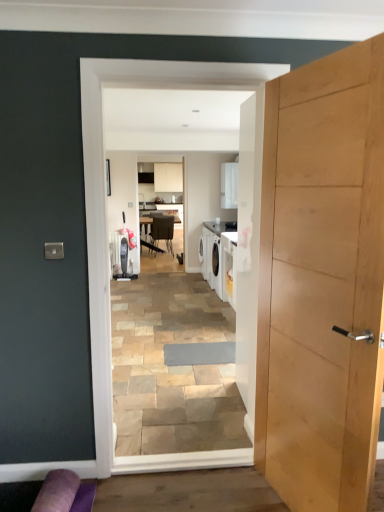
The width and height of the screenshot is (384, 512). What do you see at coordinates (64, 493) in the screenshot? I see `purple fabric couch at lower left` at bounding box center [64, 493].

What do you see at coordinates (321, 280) in the screenshot? I see `light wood door at right` at bounding box center [321, 280].

The width and height of the screenshot is (384, 512). In order to click on white glossy laundry machine at center in this screenshot , I will do `click(177, 407)`.

Locate an element on the screen. couch on the right of metallic silver chair at center is located at coordinates (64, 493).

Considering the sizes of purple fabric couch at lower left and metallic silver chair at center in the image, is purple fabric couch at lower left bigger or smaller than metallic silver chair at center?

Considering their sizes, purple fabric couch at lower left takes up less space than metallic silver chair at center.

Does point (36, 506) come in front of point (158, 222)?

That is True.

Consider the image. How many degrees apart are the facing directions of purple fabric couch at lower left and metallic silver chair at center?

The angle between the facing direction of purple fabric couch at lower left and the facing direction of metallic silver chair at center is 173 degrees.

From a real-world perspective, between purple fabric couch at lower left and white glossy laundry machine at center, who is vertically higher?

white glossy laundry machine at center is physically above.

Is point (78, 508) positioned after point (146, 263)?

No.

In the scene shown: How different are the orientations of purple fabric couch at lower left and white glossy laundry machine at center in degrees?

There is a 2.59-degree angle between the facing directions of purple fabric couch at lower left and white glossy laundry machine at center.

Can you confirm if purple fabric couch at lower left is bigger than white glossy laundry machine at center?

No.

Is white glossy laundry machine at center far from metallic silver chair at center?

Yes.

Based on the photo, which is closer to the camera, (244, 455) or (153, 216)?

Point (244, 455).

In the scene shown: Which of these two, white glossy laundry machine at center or metallic silver chair at center, is smaller?

Smaller between the two is white glossy laundry machine at center.

From the image's perspective, would you say light wood door at right is shown under white glossy laundry machine at center?

Yes, from the image's perspective, light wood door at right is below white glossy laundry machine at center.

Considering the relative positions of light wood door at right and white glossy laundry machine at center in the image provided, is light wood door at right to the left of white glossy laundry machine at center from the viewer's perspective?

No, light wood door at right is not to the left of white glossy laundry machine at center.

Considering the positions of points (270, 447) and (198, 256), is point (270, 447) closer to camera compared to point (198, 256)?

That is True.

Could you tell me if metallic silver chair at center is turned towards white glossy laundry machine at center?

No, metallic silver chair at center is not aimed at white glossy laundry machine at center.

The width and height of the screenshot is (384, 512). In order to click on residence to the right of metallic silver chair at center in this screenshot , I will do `click(177, 407)`.

Considering the positions of objects metallic silver chair at center and white glossy laundry machine at center in the image provided, who is behind, metallic silver chair at center or white glossy laundry machine at center?

metallic silver chair at center is further from the camera.

From the image's perspective, is metallic silver chair at center under white glossy laundry machine at center?

Actually, metallic silver chair at center appears above white glossy laundry machine at center in the image.

Does metallic silver chair at center have a smaller size compared to purple fabric couch at lower left?

No.

Is purple fabric couch at lower left completely or partially inside metallic silver chair at center?

No.

Is metallic silver chair at center wider than purple fabric couch at lower left?

Yes.

What's the angular difference between metallic silver chair at center and purple fabric couch at lower left's facing directions?

173 degrees separate the facing orientations of metallic silver chair at center and purple fabric couch at lower left.

From a real-world perspective, who is located higher, white glossy laundry machine at center or purple fabric couch at lower left?

From a 3D spatial view, white glossy laundry machine at center is above.

Between point (189, 380) and point (60, 469), which one is positioned in front?

The point (60, 469) is closer to the camera.

Considering the relative sizes of white glossy laundry machine at center and purple fabric couch at lower left in the image provided, is white glossy laundry machine at center wider than purple fabric couch at lower left?

In fact, white glossy laundry machine at center might be narrower than purple fabric couch at lower left.

In the image, there is a purple fabric couch at lower left. Where is `chair above it (from the image's perspective)`? The width and height of the screenshot is (384, 512). chair above it (from the image's perspective) is located at coordinates (163, 230).

Image resolution: width=384 pixels, height=512 pixels. In order to click on couch below the white glossy laundry machine at center (from a real-world perspective) in this screenshot , I will do `click(64, 493)`.

From the picture: Considering their positions, is white glossy laundry machine at center positioned closer to metallic silver chair at center than light wood door at right?

→ white glossy laundry machine at center is closer to metallic silver chair at center.

From the image, which object appears to be farther from light wood door at right, white glossy laundry machine at center or purple fabric couch at lower left?

Based on the image, purple fabric couch at lower left appears to be further to light wood door at right.

From the picture: Looking at the image, which one is located further to light wood door at right, metallic silver chair at center or white glossy laundry machine at center?

metallic silver chair at center.

Based on their spatial positions, is purple fabric couch at lower left or white glossy laundry machine at center further from light wood door at right?

Based on the image, purple fabric couch at lower left appears to be further to light wood door at right.

From the image, which object appears to be nearer to purple fabric couch at lower left, white glossy laundry machine at center or metallic silver chair at center?

Among the two, white glossy laundry machine at center is located nearer to purple fabric couch at lower left.

From the picture: Based on their spatial positions, is metallic silver chair at center or light wood door at right closer to purple fabric couch at lower left?

light wood door at right lies closer to purple fabric couch at lower left than the other object.

Estimate the real-world distances between objects in this image. Which object is further from metallic silver chair at center, purple fabric couch at lower left or light wood door at right?

light wood door at right is positioned further to the anchor metallic silver chair at center.

Looking at the image, which one is located closer to metallic silver chair at center, white glossy laundry machine at center or purple fabric couch at lower left?

Among the two, white glossy laundry machine at center is located nearer to metallic silver chair at center.

Identify the location of door between white glossy laundry machine at center and purple fabric couch at lower left from top to bottom. This screenshot has width=384, height=512. (321, 280).

This screenshot has width=384, height=512. I want to click on couch between light wood door at right and metallic silver chair at center along the z-axis, so click(64, 493).

The height and width of the screenshot is (512, 384). Identify the location of residence positioned between purple fabric couch at lower left and metallic silver chair at center from near to far. (177, 407).

Locate an element on the screen. residence between light wood door at right and metallic silver chair at center in the front-back direction is located at coordinates (177, 407).